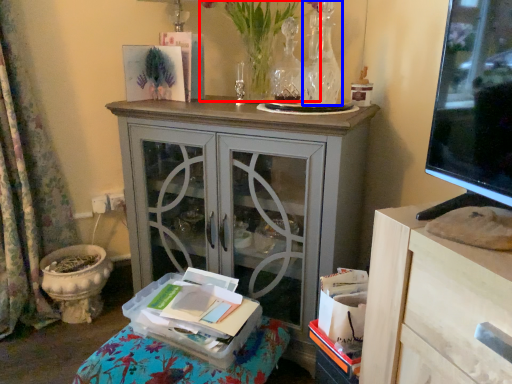
Question: Which of the following is the closest to the observer, floral arrangement (highlighted by a red box) or vase (highlighted by a blue box)?

Choices:
 (A) floral arrangement
 (B) vase

Answer: (A)